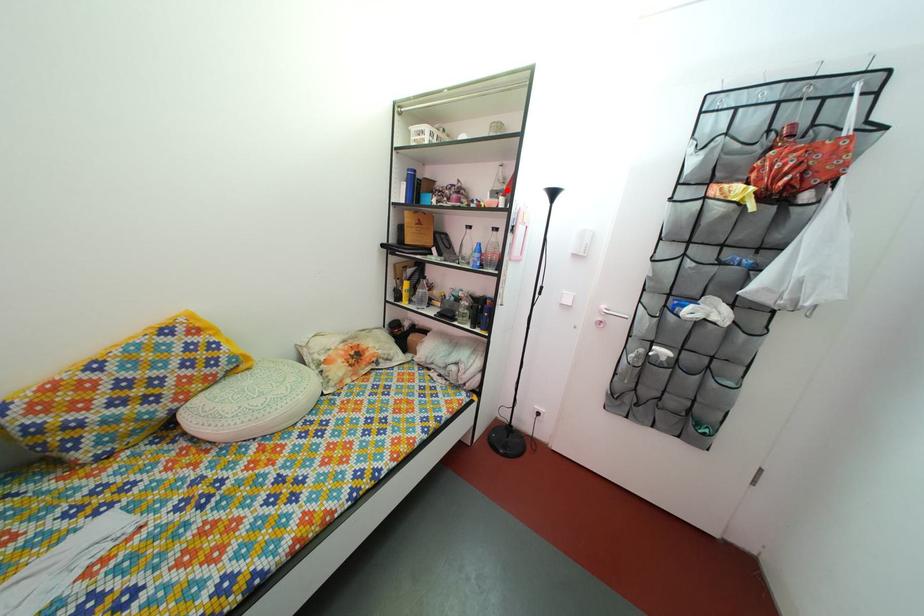
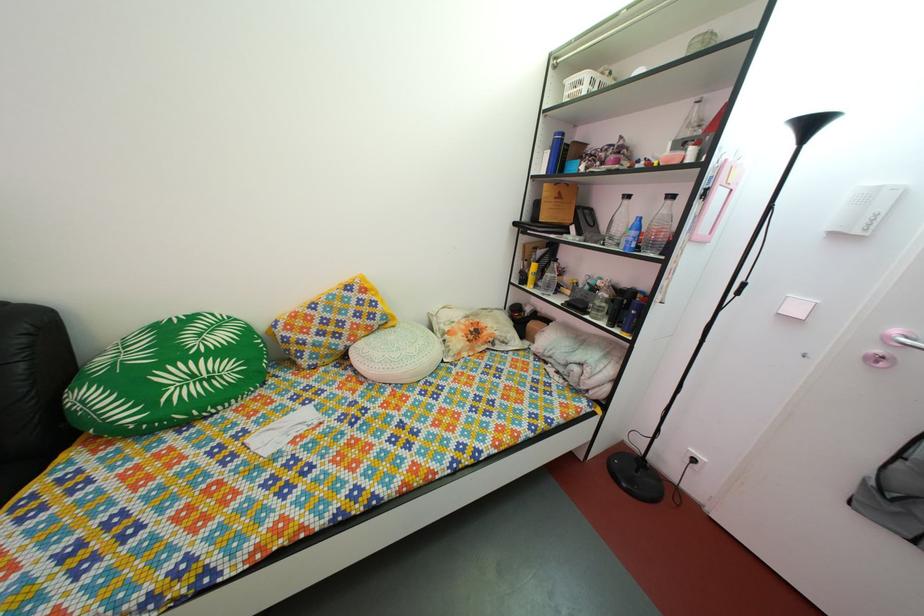
Locate, in the second image, the point that corresponds to the highlighted location in the first image.

(697, 136)